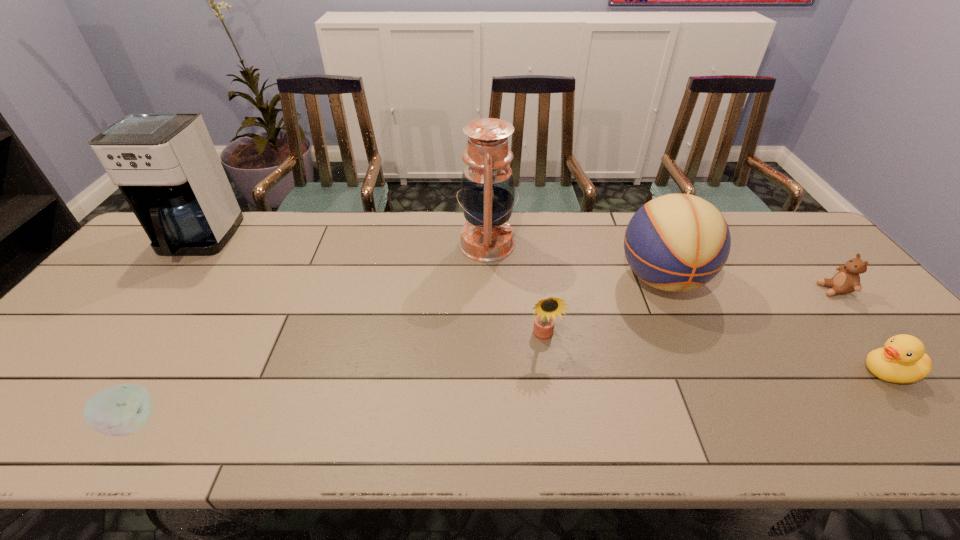
Locate an element on the screen. free spot between the teddy bear and the sunflower is located at coordinates (688, 313).

Identify the location of free space between the duck and the nearest object. The image size is (960, 540). (510, 397).

What are the coordinates of `vacant area that lies between the teddy bear and the third tallest object` in the screenshot? It's located at (748, 285).

Identify which object is located as the third nearest to the leftmost object. Please provide its 2D coordinates. Your answer should be formatted as a tuple, i.e. [(x, y)], where the tuple contains the x and y coordinates of a point satisfying the conditions above.

[(547, 309)]

Identify the location of object that is the fifth closest to the sixth object from right to left. This screenshot has width=960, height=540. (903, 359).

Locate an element on the screen. The width and height of the screenshot is (960, 540). free space that satisfies the following two spatial constraints: 1. on the back side of the fifth object from right to left; 2. on the right side of the apple is located at coordinates (246, 245).